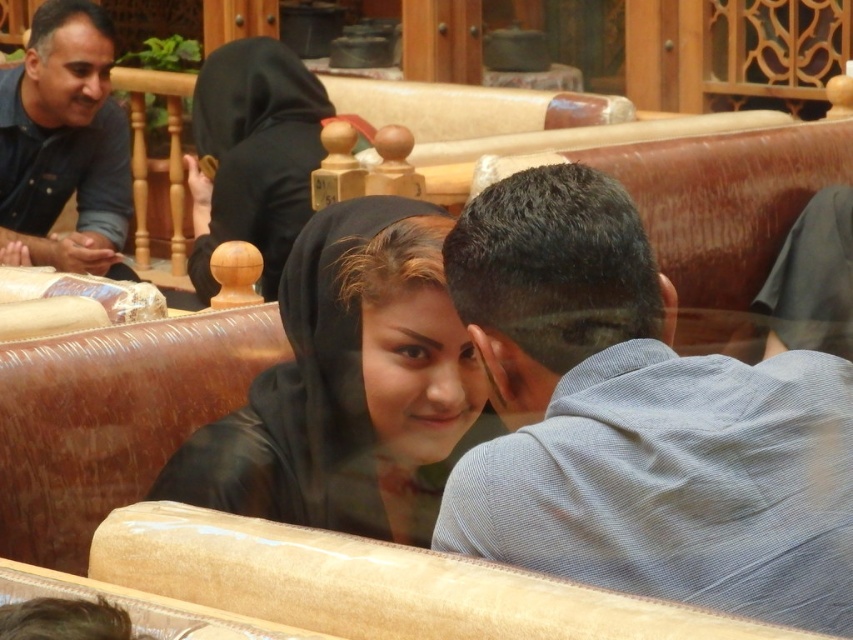
Who is shorter, blue denim shirt at upper left or black matte hijab at upper left?

black matte hijab at upper left is shorter.

Can you confirm if blue denim shirt at upper left is positioned below black matte hijab at upper left?

No.

Which is behind, point (80, 180) or point (245, 128)?

Positioned behind is point (80, 180).

Find the location of a particular element. The width and height of the screenshot is (853, 640). blue denim shirt at upper left is located at coordinates (65, 141).

Is light blue striped shirt at center above black matte hijab at upper left?

Incorrect, light blue striped shirt at center is not positioned above black matte hijab at upper left.

Who is higher up, light blue striped shirt at center or black matte hijab at upper left?

black matte hijab at upper left is above.

Does point (639, 321) come in front of point (263, 42)?

Yes, it is in front of point (263, 42).

Identify the location of light blue striped shirt at center. The height and width of the screenshot is (640, 853). click(637, 420).

Does black satin hijab at center appear on the left side of blue denim shirt at upper left?

In fact, black satin hijab at center is to the right of blue denim shirt at upper left.

Is point (438, 380) closer to viewer compared to point (62, 163)?

Yes, it is in front of point (62, 163).

Who is more distant from viewer, [344,285] or [50,164]?

The point [50,164] is more distant.

This screenshot has width=853, height=640. In order to click on black satin hijab at center in this screenshot , I will do `click(350, 387)`.